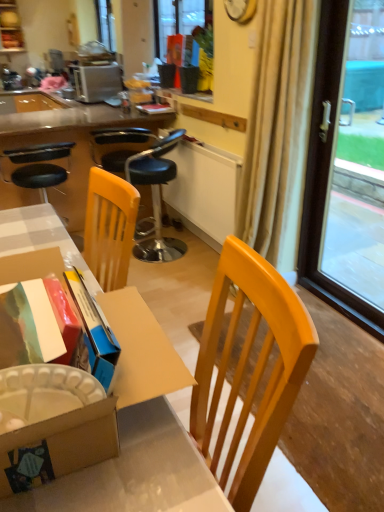
What is the approximate height of beige fabric curtain at right?

The height of beige fabric curtain at right is 1.43 meters.

I want to click on satin silver toaster at upper left, so click(98, 83).

Identify the location of matte black desk at center, the 2th desk from the bottom. Image resolution: width=384 pixels, height=512 pixels. (58, 150).

Can we say matte black flowerpot at upper center lies outside black leather stool at center, the first chair from the right?

matte black flowerpot at upper center lies outside black leather stool at center, the first chair from the right,'s area.

From the image's perspective, which is below, matte black flowerpot at upper center or black leather stool at center, which is the 2th chair from left to right?

black leather stool at center, which is the 2th chair from left to right.

In the scene shown: Who is bigger, matte black flowerpot at upper center or black leather stool at center, which is the 2th chair from left to right?

With larger size is black leather stool at center, which is the 2th chair from left to right.

Is black leather bar stool at left, the 2th chair positioned from the right, at the right side of black leather stool at center, which is the 2th chair from left to right?

No, black leather bar stool at left, the 2th chair positioned from the right, is not to the right of black leather stool at center, which is the 2th chair from left to right.

Between black leather bar stool at left, positioned as the 1th chair in left-to-right order, and black leather stool at center, which is the 2th chair from left to right, which one has larger size?

With larger size is black leather stool at center, which is the 2th chair from left to right.

From the picture: Considering their positions, is black leather bar stool at left, positioned as the 1th chair in left-to-right order, located in front of or behind black leather stool at center, which is the 2th chair from left to right?

Clearly, black leather bar stool at left, positioned as the 1th chair in left-to-right order, is behind black leather stool at center, which is the 2th chair from left to right.

In order to click on chair above the black leather stool at center, the first chair from the right (from the image's perspective) in this screenshot , I will do `click(37, 166)`.

Is the depth of black leather bar stool at left, the 2th chair positioned from the right, greater than that of matte black desk at center, the 2th desk from the bottom?

No, it is in front of matte black desk at center, the 2th desk from the bottom.

Looking at the image, does black leather bar stool at left, positioned as the 1th chair in left-to-right order, seem bigger or smaller compared to matte black desk at center, which ranks as the 1th desk in top-to-bottom order?

Considering their sizes, black leather bar stool at left, positioned as the 1th chair in left-to-right order, takes up less space than matte black desk at center, which ranks as the 1th desk in top-to-bottom order.

Does black leather bar stool at left, positioned as the 1th chair in left-to-right order, appear on the right side of matte black desk at center, marked as the 1th desk in a back-to-front arrangement?

No, black leather bar stool at left, positioned as the 1th chair in left-to-right order, is not to the right of matte black desk at center, marked as the 1th desk in a back-to-front arrangement.

Could you tell me if black leather bar stool at left, the 2th chair positioned from the right, is facing matte black desk at center, marked as the 1th desk in a back-to-front arrangement?

Yes, black leather bar stool at left, the 2th chair positioned from the right, is aimed at matte black desk at center, marked as the 1th desk in a back-to-front arrangement.

Is black leather stool at center, which is the 2th chair from left to right, to the left or to the right of beige fabric curtain at right in the image?

black leather stool at center, which is the 2th chair from left to right, is positioned on beige fabric curtain at right's left side.

Is black leather stool at center, the first chair from the right, positioned far away from beige fabric curtain at right?

black leather stool at center, the first chair from the right, is near beige fabric curtain at right, not far away.

From the picture: Who is taller, black leather stool at center, which is the 2th chair from left to right, or beige fabric curtain at right?

beige fabric curtain at right.

Which point is more forward, (123,134) or (248,228)?

The point (248,228) is closer to the camera.

Considering the relative positions of matte black desk at center, the 2th desk from the bottom, and matte black flowerpot at upper center in the image provided, is matte black desk at center, the 2th desk from the bottom, behind matte black flowerpot at upper center?

No, matte black desk at center, the 2th desk from the bottom, is closer to the viewer.

Between matte black desk at center, marked as the 1th desk in a back-to-front arrangement, and matte black flowerpot at upper center, which one appears on the left side from the viewer's perspective?

Positioned to the left is matte black desk at center, marked as the 1th desk in a back-to-front arrangement.

Between point (75, 204) and point (191, 73), which one is positioned in front?

The point (191, 73) is more forward.

Which is closer to the camera, (135, 246) or (195, 83)?

Positioned in front is point (195, 83).

Is black leather stool at center, which is the 2th chair from left to right, not near matte black flowerpot at upper center?

black leather stool at center, which is the 2th chair from left to right, is near matte black flowerpot at upper center, not far away.

Is matte black flowerpot at upper center a part of black leather stool at center, which is the 2th chair from left to right?

No, black leather stool at center, which is the 2th chair from left to right, does not contain matte black flowerpot at upper center.

Which of these two, black leather stool at center, which is the 2th chair from left to right, or matte black flowerpot at upper center, stands shorter?

With less height is matte black flowerpot at upper center.

Can you tell me how much wooden desk at center, the second desk viewed from the top, and matte black desk at center, marked as the 1th desk in a back-to-front arrangement, differ in facing direction?

89.7 degrees separate the facing orientations of wooden desk at center, the second desk viewed from the top, and matte black desk at center, marked as the 1th desk in a back-to-front arrangement.

From the image's perspective, is wooden desk at center, the second desk viewed from the top, located beneath matte black desk at center, which appears as the second desk when viewed from the front?

Yes, from the image's perspective, wooden desk at center, the second desk viewed from the top, is beneath matte black desk at center, which appears as the second desk when viewed from the front.

Which point is more distant from viewer, (26, 212) or (40, 129)?

Point (40, 129)

Is wooden desk at center, the second desk viewed from the top, positioned with its back to matte black desk at center, which appears as the second desk when viewed from the front?

No, wooden desk at center, the second desk viewed from the top, is not facing the opposite direction of matte black desk at center, which appears as the second desk when viewed from the front.

There is a black leather stool at center, which is the 2th chair from left to right. What are the coordinates of `flowerpot above it (from a real-world perspective)` in the screenshot? It's located at (189, 79).

The height and width of the screenshot is (512, 384). In order to click on chair behind the black leather stool at center, the first chair from the right in this screenshot , I will do `click(37, 166)`.

Based on their spatial positions, is black leather bar stool at left, positioned as the 1th chair in left-to-right order, or transparent glass window at right further from beige fabric curtain at right?

Based on the image, black leather bar stool at left, positioned as the 1th chair in left-to-right order, appears to be further to beige fabric curtain at right.

From the image, which object appears to be farther from wooden desk at center, arranged as the 1th desk when viewed from the front, black leather bar stool at left, the 2th chair positioned from the right, or matte black desk at center, which ranks as the 1th desk in top-to-bottom order?

Based on the image, matte black desk at center, which ranks as the 1th desk in top-to-bottom order, appears to be further to wooden desk at center, arranged as the 1th desk when viewed from the front.

From the picture: Based on their spatial positions, is black leather stool at center, which is the 2th chair from left to right, or beige fabric curtain at right closer to satin silver toaster at upper left?

black leather stool at center, which is the 2th chair from left to right.

Looking at the image, which one is located closer to transparent glass window at right, black leather bar stool at left, positioned as the 1th chair in left-to-right order, or wooden desk at center, arranged as the 1th desk when viewed from the front?

Among the two, wooden desk at center, arranged as the 1th desk when viewed from the front, is located nearer to transparent glass window at right.

From the image, which object appears to be nearer to black leather bar stool at left, the 2th chair positioned from the right, matte black desk at center, which ranks as the 1th desk in top-to-bottom order, or transparent glass window at right?

matte black desk at center, which ranks as the 1th desk in top-to-bottom order.

Looking at the image, which one is located closer to black leather stool at center, the first chair from the right, matte black flowerpot at upper center or satin silver toaster at upper left?

Among the two, matte black flowerpot at upper center is located nearer to black leather stool at center, the first chair from the right.

Based on their spatial positions, is black leather stool at center, the first chair from the right, or beige fabric curtain at right further from black leather bar stool at left, positioned as the 1th chair in left-to-right order?

beige fabric curtain at right is positioned further to the anchor black leather bar stool at left, positioned as the 1th chair in left-to-right order.

When comparing their distances from matte black desk at center, marked as the 1th desk in a back-to-front arrangement, does black leather bar stool at left, positioned as the 1th chair in left-to-right order, or transparent glass window at right seem further?

Based on the image, transparent glass window at right appears to be further to matte black desk at center, marked as the 1th desk in a back-to-front arrangement.

Locate an element on the screen. This screenshot has width=384, height=512. desk located between wooden desk at center, arranged as the 1th desk when viewed from the front, and matte black flowerpot at upper center in the depth direction is located at coordinates pyautogui.click(x=58, y=150).

At what (x,y) coordinates should I click in order to perform the action: click on chair between matte black desk at center, marked as the 1th desk in a back-to-front arrangement, and transparent glass window at right. Please return your answer as a coordinate pair (x, y). This screenshot has height=512, width=384. Looking at the image, I should click on (145, 181).

Find the location of a particular element. The width and height of the screenshot is (384, 512). desk between black leather stool at center, the first chair from the right, and satin silver toaster at upper left in the front-back direction is located at coordinates (58, 150).

Locate an element on the screen. The width and height of the screenshot is (384, 512). flowerpot between black leather stool at center, the first chair from the right, and satin silver toaster at upper left, along the z-axis is located at coordinates (189, 79).